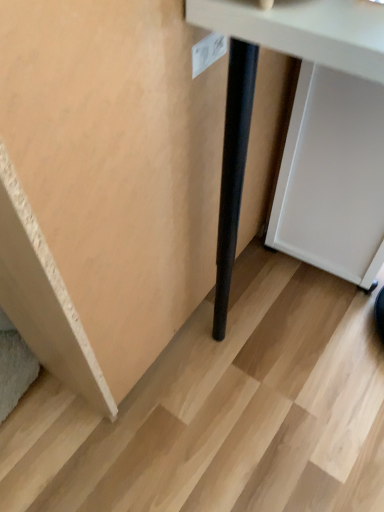
Describe the element at coordinates (323, 127) in the screenshot. I see `black matte table leg at lower center` at that location.

This screenshot has width=384, height=512. Identify the location of black matte table leg at lower center. (323, 127).

Locate an element on the screen. The image size is (384, 512). black matte table leg at lower center is located at coordinates (323, 127).